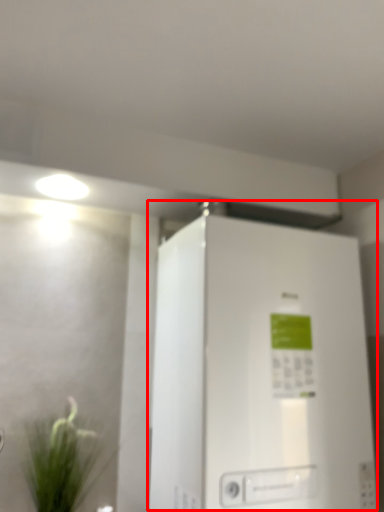
Question: From the image's perspective, where is refrigerator (annotated by the red box) located in relation to houseplant in the image?

Choices:
 (A) above
 (B) below

Answer: (A)